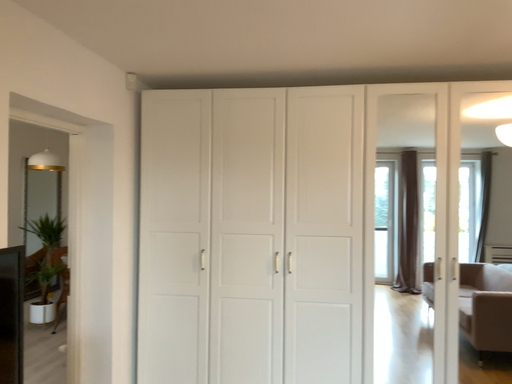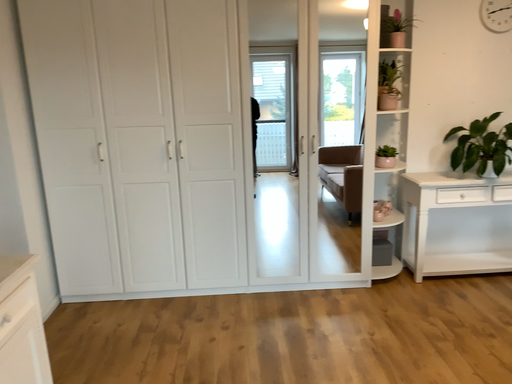
Question: How did the camera likely rotate when shooting the video?

Choices:
 (A) rotated downward
 (B) rotated upward

Answer: (A)